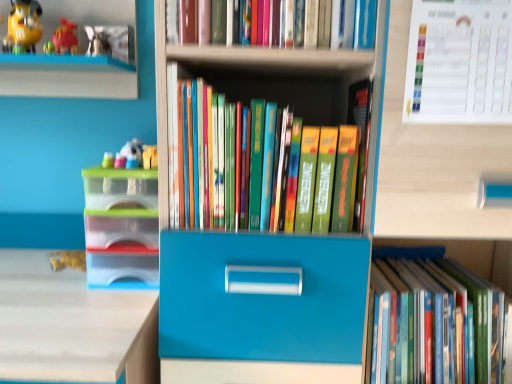
Question: From a real-world perspective, is hardcover book at lower right, positioned as the 1th book in bottom-to-top order, physically above white paper calendar at upper right?

Choices:
 (A) yes
 (B) no

Answer: (B)

Question: Considering the relative sizes of hardcover book at lower right, the third book from the top, and white paper calendar at upper right in the image provided, is hardcover book at lower right, the third book from the top, smaller than white paper calendar at upper right?

Choices:
 (A) no
 (B) yes

Answer: (A)

Question: Can you confirm if hardcover book at lower right, the third book from the top, is wider than white paper calendar at upper right?

Choices:
 (A) no
 (B) yes

Answer: (B)

Question: Is hardcover book at lower right, the third book from the top, located outside white paper calendar at upper right?

Choices:
 (A) no
 (B) yes

Answer: (B)

Question: From the image's perspective, is hardcover book at lower right, positioned as the 1th book in bottom-to-top order, below white paper calendar at upper right?

Choices:
 (A) yes
 (B) no

Answer: (A)

Question: From the image's perspective, is hardcover book at lower right, the third book from the top, located above or below plastic toy at left, marked as the second toy in a top-to-bottom arrangement?

Choices:
 (A) below
 (B) above

Answer: (A)

Question: Does point (386, 377) appear closer or farther from the camera than point (130, 158)?

Choices:
 (A) closer
 (B) farther

Answer: (B)

Question: In terms of width, does hardcover book at lower right, the third book from the top, look wider or thinner when compared to plastic toy at left, which appears as the first toy when ordered from the bottom?

Choices:
 (A) thin
 (B) wide

Answer: (B)

Question: Choose the correct answer: Is hardcover book at lower right, positioned as the 1th book in bottom-to-top order, inside plastic toy at left, which is the second toy in left-to-right order, or outside it?

Choices:
 (A) inside
 (B) outside

Answer: (B)

Question: Is matte yellow toy at upper left, which is counted as the 2th toy, starting from the right, in front of or behind hardcover books at center, the 2th book ordered from the bottom, in the image?

Choices:
 (A) behind
 (B) front

Answer: (A)

Question: In terms of size, does matte yellow toy at upper left, which is counted as the 2th toy, starting from the right, appear bigger or smaller than hardcover books at center, which ranks as the 2th book in top-to-bottom order?

Choices:
 (A) big
 (B) small

Answer: (B)

Question: Is matte yellow toy at upper left, the 1th toy when ordered from left to right, to the left or to the right of hardcover books at center, which ranks as the 2th book in top-to-bottom order, in the image?

Choices:
 (A) left
 (B) right

Answer: (A)

Question: Looking at their shapes, would you say matte yellow toy at upper left, positioned as the 2th toy in bottom-to-top order, is wider or thinner than hardcover books at center, which ranks as the 2th book in top-to-bottom order?

Choices:
 (A) wide
 (B) thin

Answer: (B)

Question: Do you think white paper calendar at upper right is within hardcover books at center, which ranks as the 2th book in top-to-bottom order, or outside of it?

Choices:
 (A) outside
 (B) inside

Answer: (A)

Question: From a real-world perspective, is white paper calendar at upper right positioned above or below hardcover books at center, which ranks as the 2th book in top-to-bottom order?

Choices:
 (A) above
 (B) below

Answer: (A)